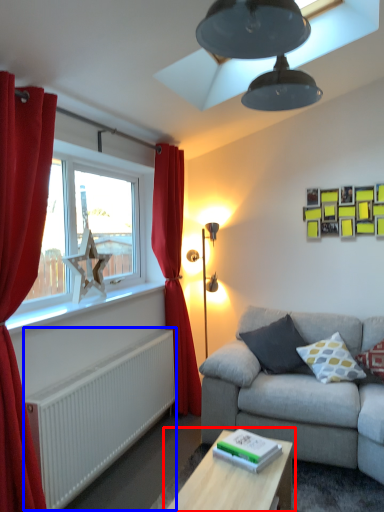
Question: Which object is closer to the camera taking this photo, table (highlighted by a red box) or radiator (highlighted by a blue box)?

Choices:
 (A) table
 (B) radiator

Answer: (A)